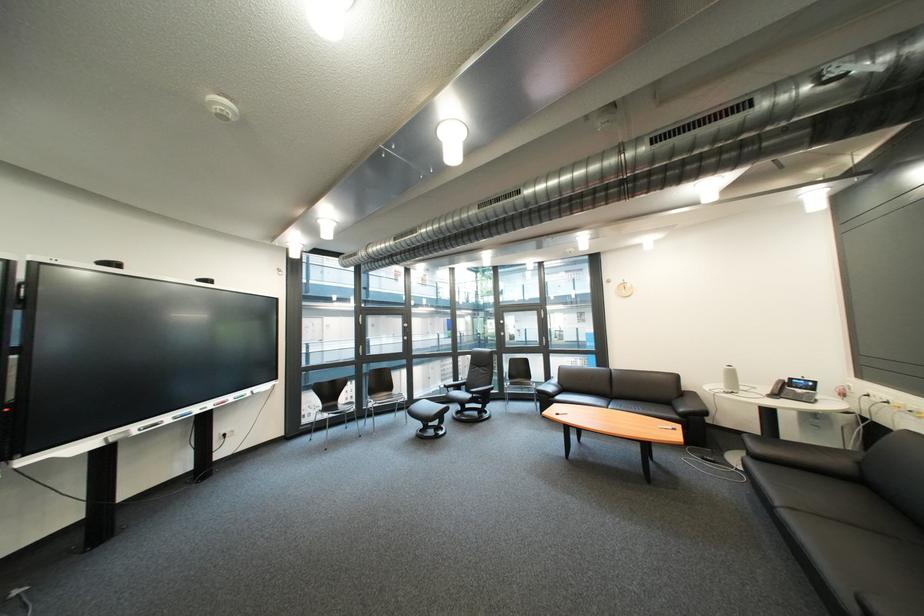
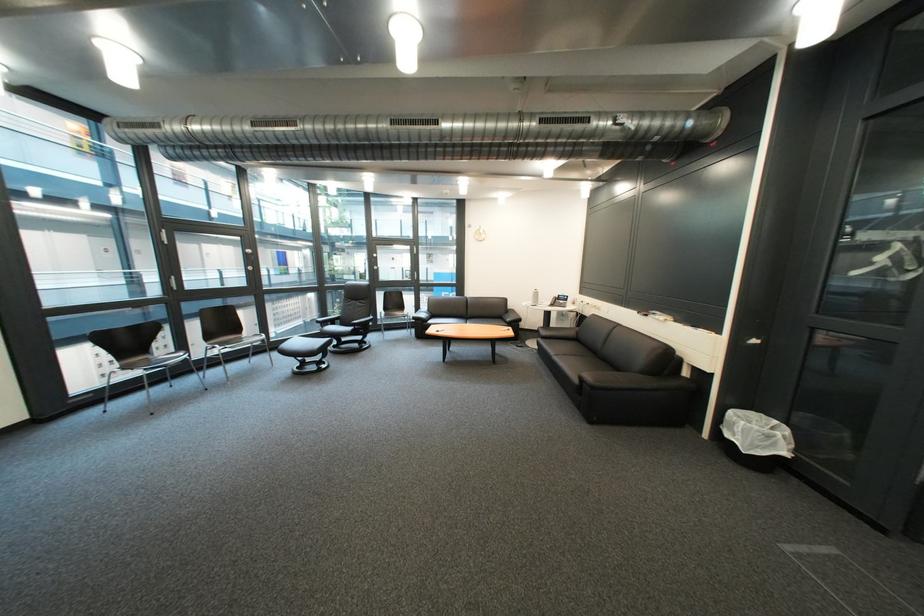
In the second image, find the point that corresponds to point 771,459 in the first image.

(556, 339)